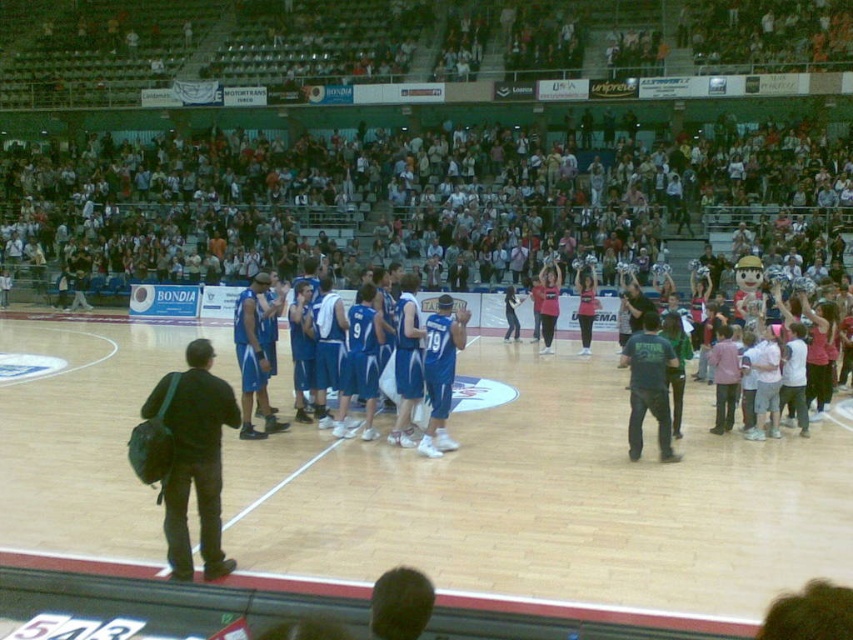
Question: Can you confirm if blue fabric jersey at center is bigger than black fabric bag at left?

Choices:
 (A) yes
 (B) no

Answer: (A)

Question: Which object is positioned farthest from the wooden floor at center?

Choices:
 (A) black fabric bag at left
 (B) blue fabric jersey at center
 (C) dark green jersey at center
 (D) pink jersey at center

Answer: (D)

Question: Considering the relative positions of wooden floor at center and pink jersey at center in the image provided, where is wooden floor at center located with respect to pink jersey at center?

Choices:
 (A) above
 (B) below

Answer: (B)

Question: Can you confirm if wooden floor at center is positioned above black fabric bag at left?

Choices:
 (A) no
 (B) yes

Answer: (B)

Question: Which of the following is the closest to the observer?

Choices:
 (A) (582, 316)
 (B) (549, 275)

Answer: (A)

Question: Which object is farther from the camera taking this photo?

Choices:
 (A) black fabric bag at left
 (B) dark green jersey at center
 (C) pink fabric cheerleader at center

Answer: (C)